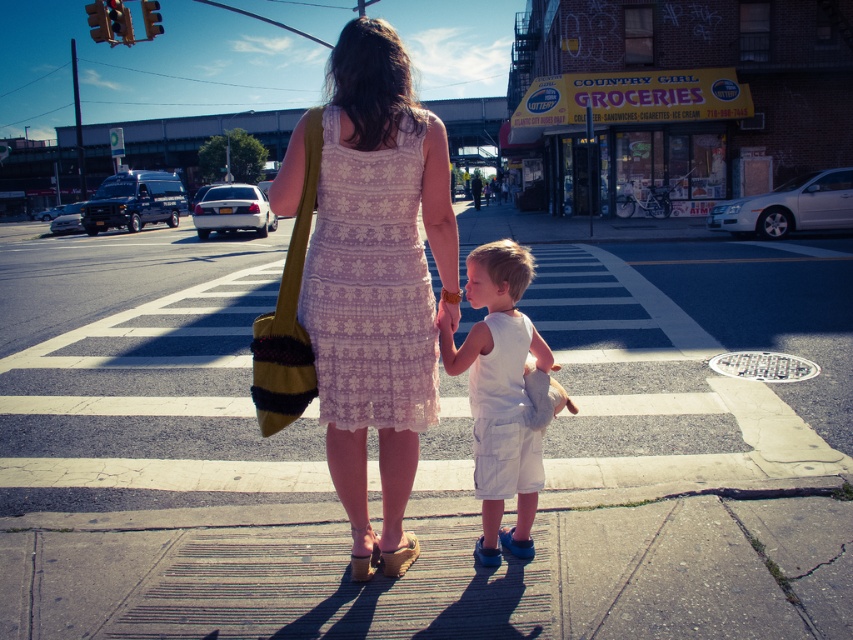
Question: Which object is farther from the camera taking this photo?

Choices:
 (A) white lace dress at center
 (B) lace fabric dress at center
 (C) white cotton shorts at center

Answer: (C)

Question: Considering the relative positions of white lace dress at center and white cotton shorts at center in the image provided, where is white lace dress at center located with respect to white cotton shorts at center?

Choices:
 (A) left
 (B) right

Answer: (A)

Question: Estimate the real-world distances between objects in this image. Which object is closer to the gray concrete sidewalk at center?

Choices:
 (A) white lace dress at center
 (B) lace fabric dress at center

Answer: (B)

Question: Among these objects, which one is farthest from the camera?

Choices:
 (A) lace fabric dress at center
 (B) white cotton shorts at center

Answer: (B)

Question: Does gray concrete sidewalk at center have a larger size compared to lace fabric dress at center?

Choices:
 (A) no
 (B) yes

Answer: (B)

Question: Does gray concrete sidewalk at center have a smaller size compared to lace fabric dress at center?

Choices:
 (A) yes
 (B) no

Answer: (B)